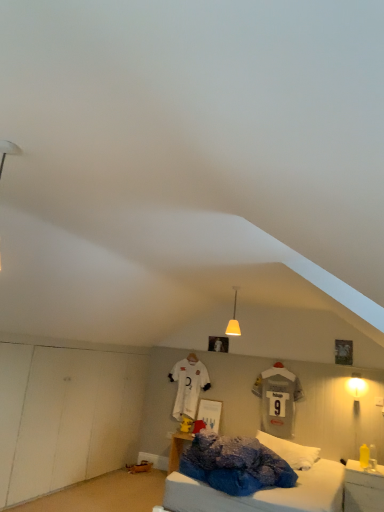
In order to click on vacant area on top of matte yellow glass pendant light at center, placed as the 1th light fixture when sorted from top to bottom (from a real-world perspective) in this screenshot , I will do `click(246, 285)`.